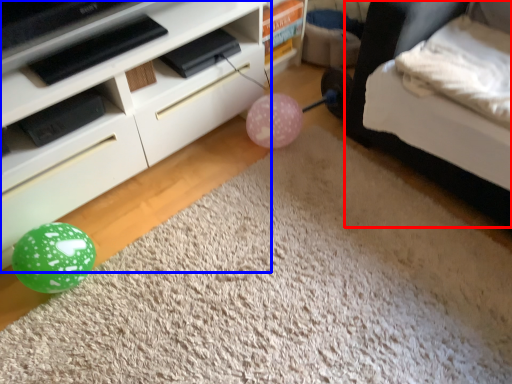
Question: Which object appears farthest to the camera in this image, bed (highlighted by a red box) or furniture (highlighted by a blue box)?

Choices:
 (A) bed
 (B) furniture

Answer: (B)